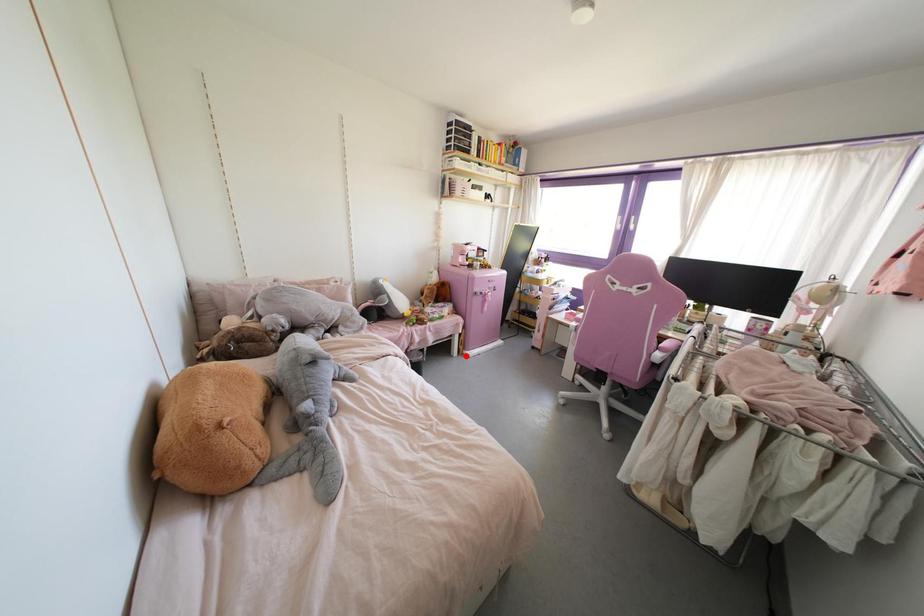
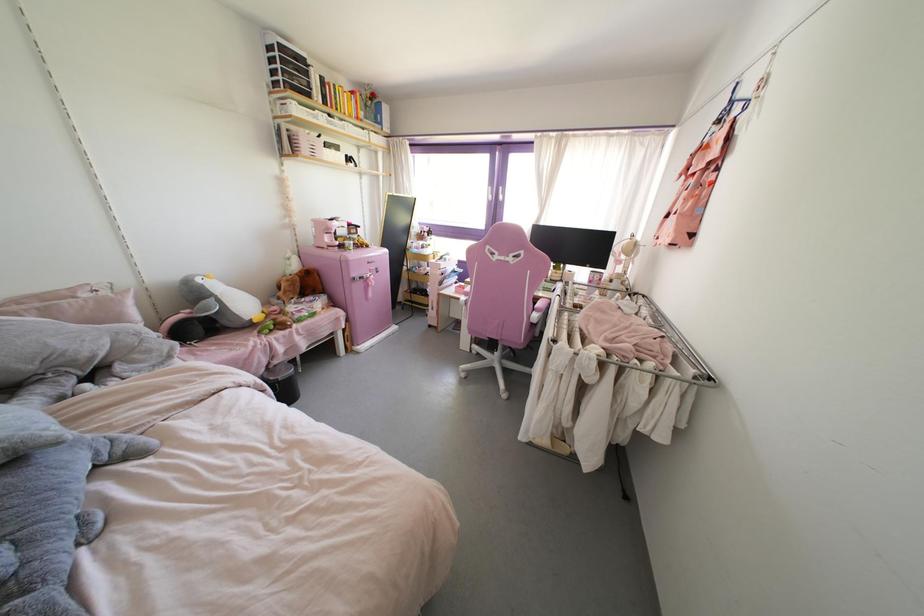
In the second image, find the point that corresponds to the highlighted location in the first image.

(357, 352)